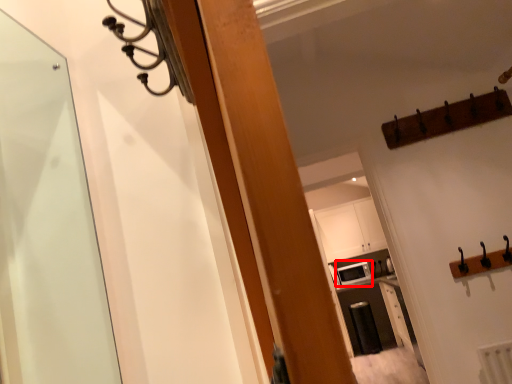
Question: From the image's perspective, what is the correct spatial relationship of appliance (annotated by the red box) in relation to cabinetry?

Choices:
 (A) above
 (B) below

Answer: (B)